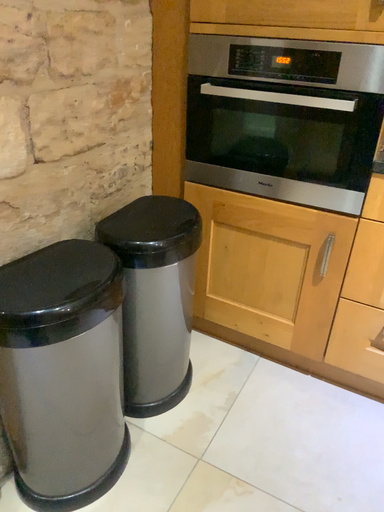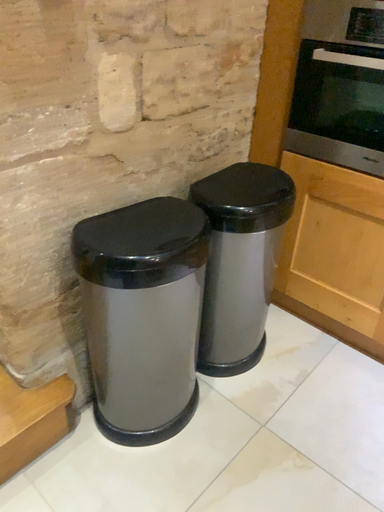
Question: Which way did the camera rotate in the video?

Choices:
 (A) rotated left
 (B) rotated right

Answer: (A)